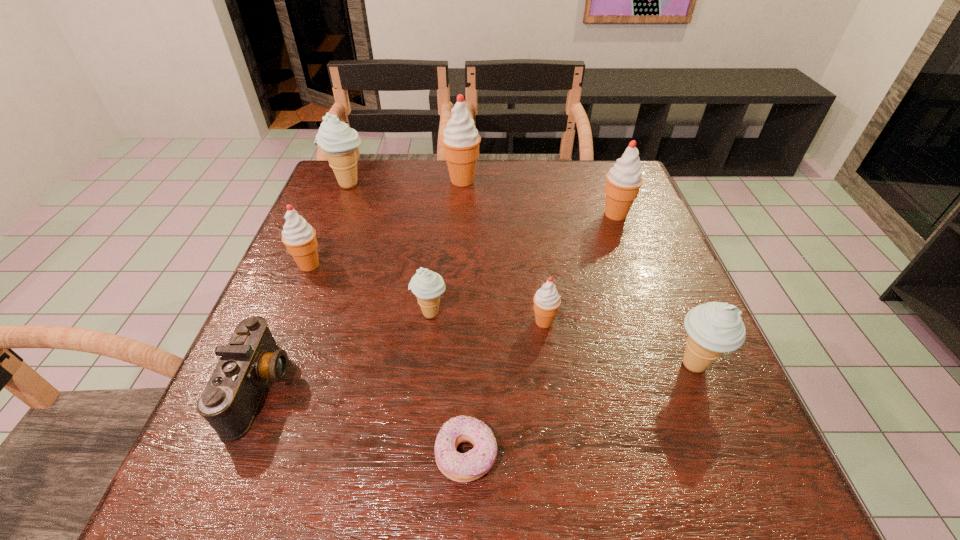
I want to click on the second farthest beige icecream, so click(x=427, y=285).

Locate an element on the screen. The width and height of the screenshot is (960, 540). the smallest beige icecream is located at coordinates (427, 285).

Identify the location of the third icecream from right to left. (546, 300).

I want to click on the smallest red icecream, so click(546, 300).

Find the location of a particular element. camera is located at coordinates (231, 398).

Identify the location of the shortest object. This screenshot has height=540, width=960. (469, 466).

I want to click on purple doughnut, so click(x=469, y=466).

I want to click on free space located on the left of the biggest red icecream, so click(410, 180).

You are a GUI agent. You are given a task and a screenshot of the screen. Output one action in this format:
    pyautogui.click(x=<x>, y=<y>)
    Task: Click on the free spot located on the front of the biggest beige icecream
    
    Given the screenshot: What is the action you would take?
    pyautogui.click(x=328, y=234)

I want to click on free location located on the front of the fifth nearest icecream, so click(x=636, y=266).